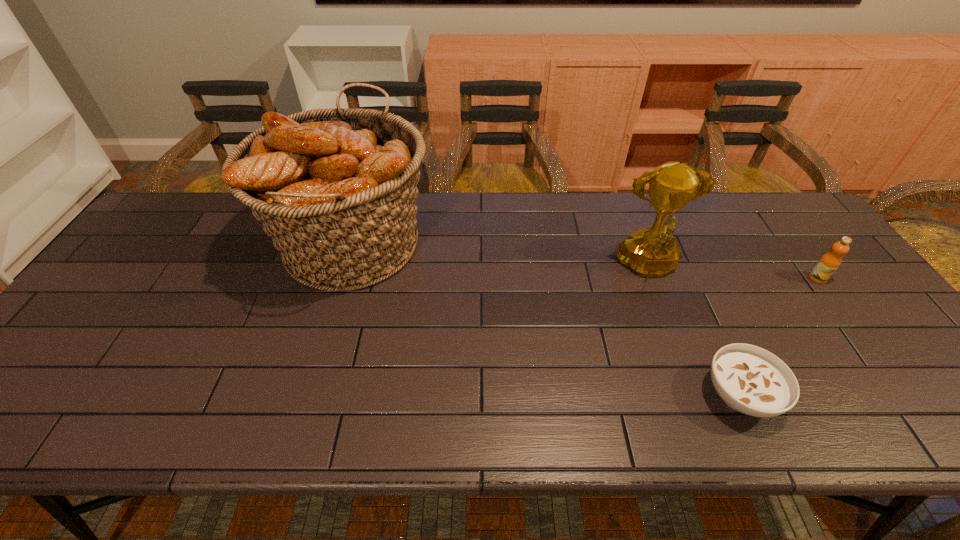
Identify the location of the tallest object. (335, 189).

The width and height of the screenshot is (960, 540). Find the location of `the leftmost object`. the leftmost object is located at coordinates (335, 189).

Locate an element on the screen. The height and width of the screenshot is (540, 960). award is located at coordinates (651, 252).

The image size is (960, 540). Find the location of `the second shortest object`. the second shortest object is located at coordinates (827, 265).

Locate an element on the screen. This screenshot has width=960, height=540. the rightmost object is located at coordinates (827, 265).

Locate an element on the screen. The width and height of the screenshot is (960, 540). soup bowl is located at coordinates (751, 380).

You are a GUI agent. You are given a task and a screenshot of the screen. Output one action in this format:
    pyautogui.click(x=<x>, y=<y>)
    Task: Click on the nearest object
    Image resolution: width=960 pixels, height=540 pixels.
    Given the screenshot: What is the action you would take?
    pyautogui.click(x=751, y=380)

Find the location of `vacant space situated 0.380m on the right of the basket`. vacant space situated 0.380m on the right of the basket is located at coordinates (563, 244).

This screenshot has height=540, width=960. I want to click on free region located 0.160m on the front side of the award, so click(678, 346).

The image size is (960, 540). In order to click on vacant position located on the front label of the second shortest object in this screenshot , I will do `click(832, 298)`.